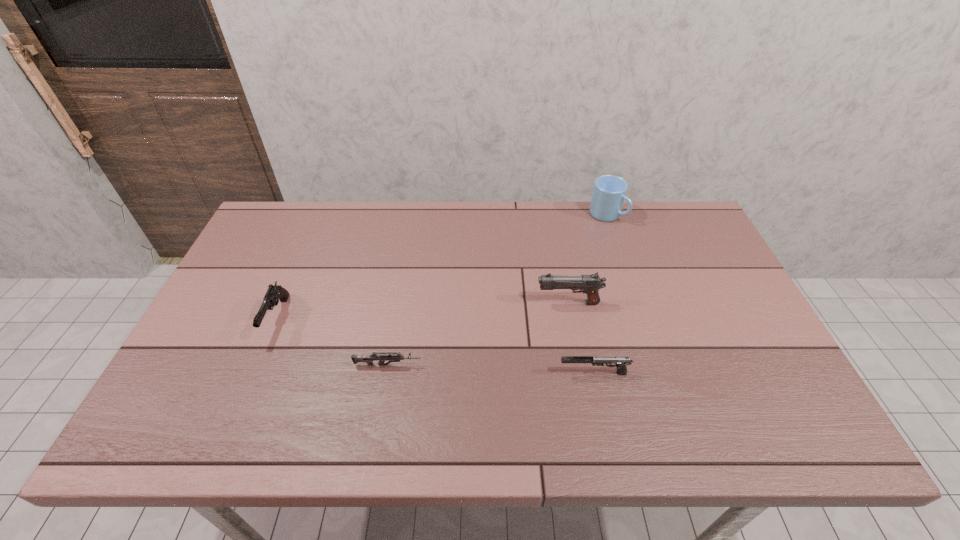
The height and width of the screenshot is (540, 960). Find the location of `free space that satisfies the following two spatial constraints: 1. on the front side of the farthest object; 2. aimed along the barrel of the shortest gun`. free space that satisfies the following two spatial constraints: 1. on the front side of the farthest object; 2. aimed along the barrel of the shortest gun is located at coordinates (657, 365).